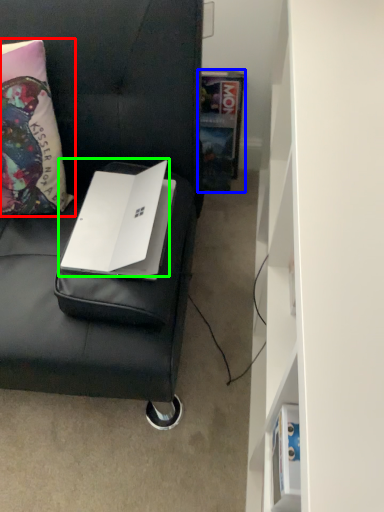
Question: Which object is the farthest from pillow (highlighted by a red box)? Choose among these: book (highlighted by a blue box) or laptop (highlighted by a green box).

Choices:
 (A) book
 (B) laptop

Answer: (A)